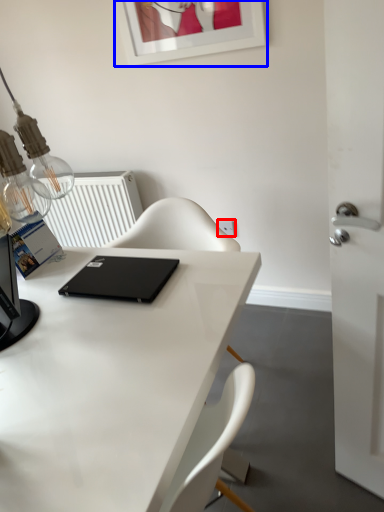
Question: Which of the following is the farthest to the observer, electric outlet (highlighted by a red box) or picture frame (highlighted by a blue box)?

Choices:
 (A) electric outlet
 (B) picture frame

Answer: (A)